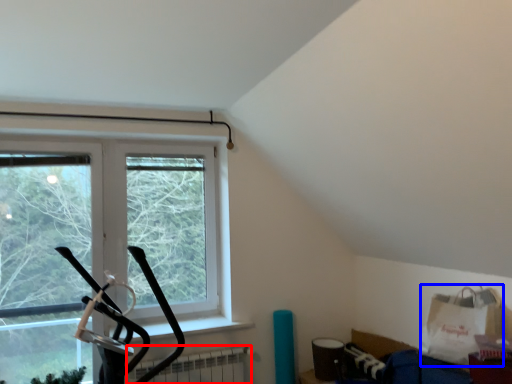
Question: Which of the following is the farthest to the observer, radiator (highlighted by a red box) or grocery bag (highlighted by a blue box)?

Choices:
 (A) radiator
 (B) grocery bag

Answer: (A)